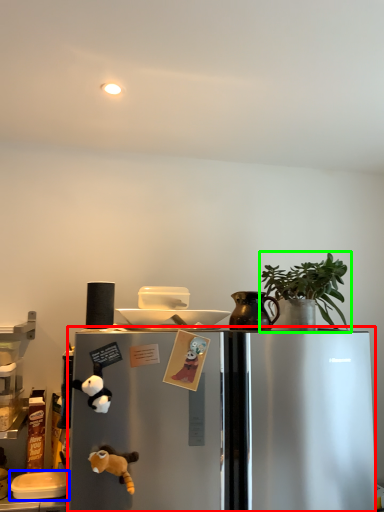
Question: Which object is positioned farthest from refrigerator (highlighted by a red box)? Select from appliance (highlighted by a blue box) and houseplant (highlighted by a green box).

Choices:
 (A) appliance
 (B) houseplant

Answer: (A)